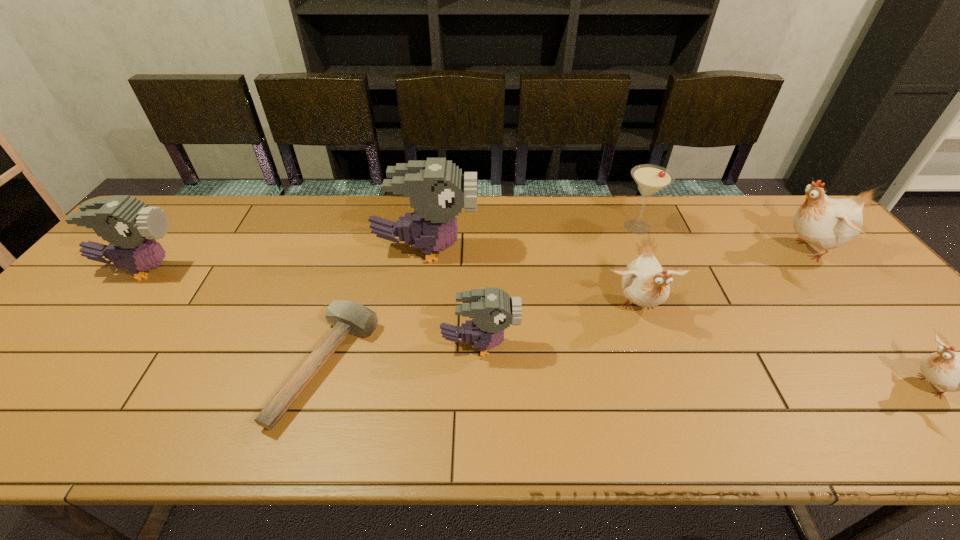
Select which white bird appears as the second closest to the biggest gray bird. Please provide its 2D coordinates. Your answer should be formatted as a tuple, i.e. [(x, y)], where the tuple contains the x and y coordinates of a point satisfying the conditions above.

[(826, 223)]

Where is `vacant region that satisfies the following two spatial constraints: 1. on the front side of the martini; 2. at the beak of the biggest gray bird`? vacant region that satisfies the following two spatial constraints: 1. on the front side of the martini; 2. at the beak of the biggest gray bird is located at coordinates (647, 251).

Image resolution: width=960 pixels, height=540 pixels. Identify the location of free region that satisfies the following two spatial constraints: 1. at the beak of the biggest white bird; 2. at the beak of the second biggest white bird. (852, 307).